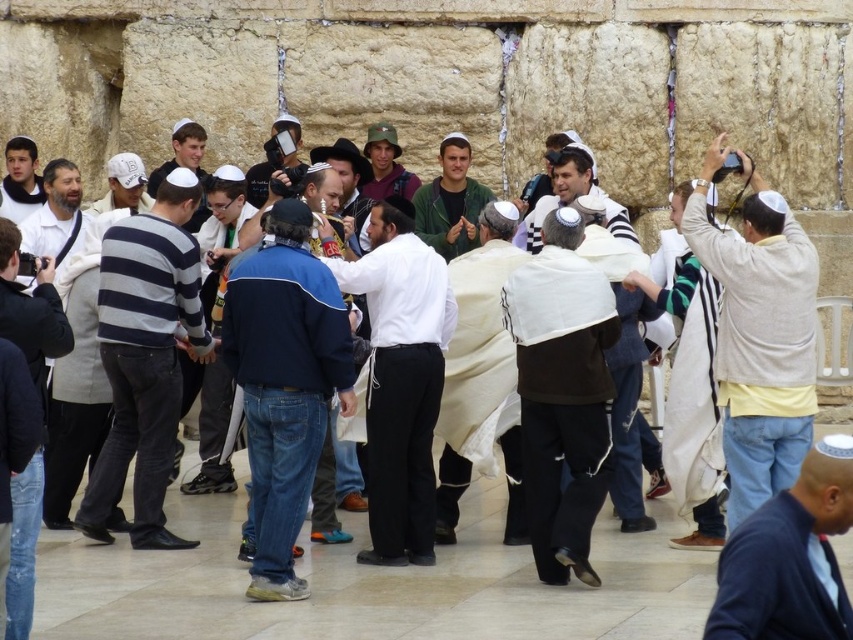
You are a photographer trying to capture a candid shot of the blue fleece jacket at center and the dark blue sweater at lower right. Since you want both subjects to be in focus, you need to know which one is closer to you. According to the scene, which one is nearer?

The blue fleece jacket at center is positioned over the dark blue sweater at lower right, meaning it is closer to you.

You are standing at the bottom left corner of the image. You want to place a new object at the same location as the white fabric shawl at center. What are the 2D coordinates you should use?

The 2D coordinates for the white fabric shawl at center are at point (561, 401). So you should place the new object at coordinates (561, 401).